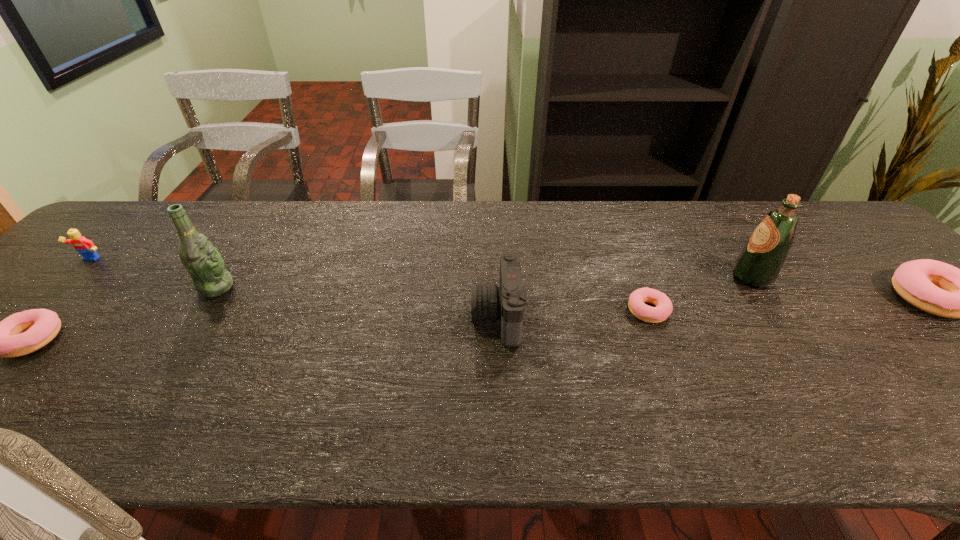
This screenshot has width=960, height=540. I want to click on free spot between the third object from left to right and the second object from right to left, so (484, 282).

You are a GUI agent. You are given a task and a screenshot of the screen. Output one action in this format:
    pyautogui.click(x=<x>, y=<y>)
    Task: Click on the empty location between the second object from right to left and the fourth object from right to left
    
    Given the screenshot: What is the action you would take?
    pyautogui.click(x=624, y=296)

The width and height of the screenshot is (960, 540). I want to click on free space that is in between the fourth object from left to right and the sixth object from left to right, so click(624, 296).

Where is `empty location between the olive oil and the beer bottle`? This screenshot has width=960, height=540. empty location between the olive oil and the beer bottle is located at coordinates (484, 282).

Find the location of `object identified as the fourth closest to the beer bottle`. object identified as the fourth closest to the beer bottle is located at coordinates (638, 298).

Identify which object is the third nearest to the camera. Please provide its 2D coordinates. Your answer should be formatted as a tuple, i.e. [(x, y)], where the tuple contains the x and y coordinates of a point satisfying the conditions above.

[(206, 267)]

Locate an element on the screen. doughnut that is the second closest one to the beer bottle is located at coordinates (638, 298).

Select which doughnut is the closest to the Lego. Please provide its 2D coordinates. Your answer should be formatted as a tuple, i.e. [(x, y)], where the tuple contains the x and y coordinates of a point satisfying the conditions above.

[(22, 333)]

Where is `free space that satisfies the following two spatial constraints: 1. on the face of the fourth shortest object; 2. on the right side of the fifth object from left to right`? The image size is (960, 540). free space that satisfies the following two spatial constraints: 1. on the face of the fourth shortest object; 2. on the right side of the fifth object from left to right is located at coordinates click(x=39, y=310).

Locate an element on the screen. This screenshot has width=960, height=540. free spot that satisfies the following two spatial constraints: 1. on the surface of the third object from left to right; 2. on the left side of the shortest object is located at coordinates (202, 310).